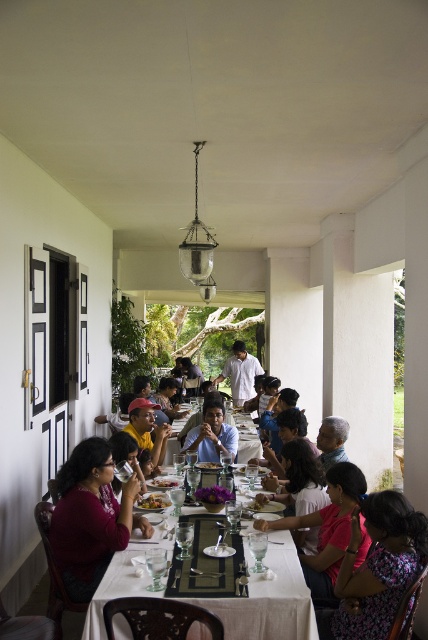
Question: Based on their relative distances, which object is farther from the golden brown rice at center?

Choices:
 (A) smooth white plate at center
 (B) gray hair at center
 (C) white cotton shirt at center

Answer: (C)

Question: Can you confirm if white glossy table at center is smaller than gray hair at center?

Choices:
 (A) no
 (B) yes

Answer: (A)

Question: Which object is positioned closest to the floral fabric dress at lower right?

Choices:
 (A) white cotton shirt at center
 (B) green leafy salad at center
 (C) gray hair at center

Answer: (C)

Question: Which of the following is the closest to the observer?

Choices:
 (A) gray hair at center
 (B) floral fabric dress at lower right
 (C) blue shirt at center
 (D) white cotton shirt at center

Answer: (B)

Question: Does matte black cap at center appear on the right side of gray hair at center?

Choices:
 (A) no
 (B) yes

Answer: (A)

Question: Is white cotton shirt at center wider than green leafy salad at center?

Choices:
 (A) yes
 (B) no

Answer: (A)